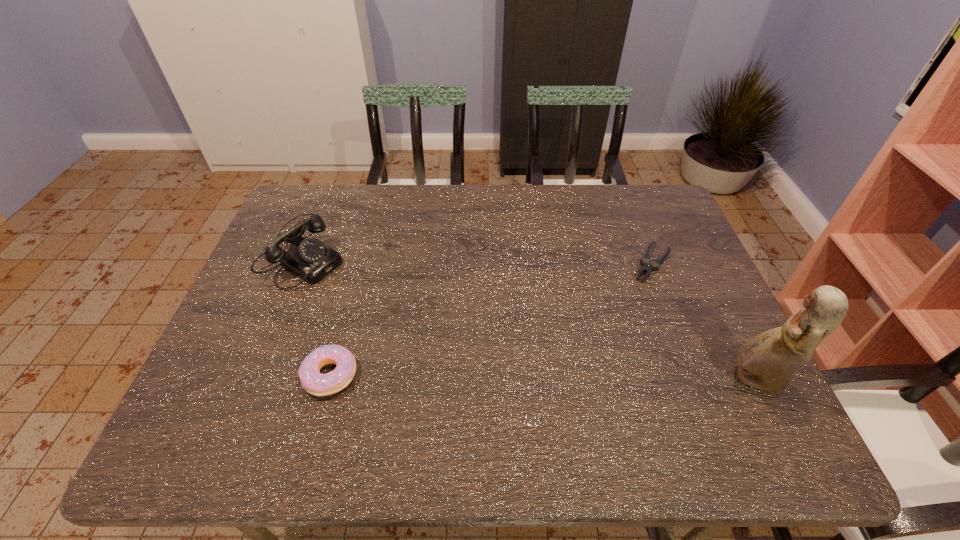
Where is `figurine positioned at the right edge`? The image size is (960, 540). figurine positioned at the right edge is located at coordinates (768, 361).

Identify the location of pliers positioned at the right edge. The image size is (960, 540). (655, 265).

You are a GUI agent. You are given a task and a screenshot of the screen. Output one action in this format:
    pyautogui.click(x=<x>, y=<y>)
    Task: Click on the object that is at the far left corner
    The width and height of the screenshot is (960, 540).
    Given the screenshot: What is the action you would take?
    pyautogui.click(x=308, y=258)

Image resolution: width=960 pixels, height=540 pixels. In order to click on object that is positioned at the near right corner in this screenshot , I will do pyautogui.click(x=768, y=361).

Where is `vacant region at the far edge of the desktop`? vacant region at the far edge of the desktop is located at coordinates (406, 201).

Find the location of a particular element. The height and width of the screenshot is (540, 960). vacant space at the near edge of the desktop is located at coordinates (520, 390).

The width and height of the screenshot is (960, 540). In the image, there is a desktop. Find the location of `free space at the left edge`. free space at the left edge is located at coordinates click(x=238, y=325).

Find the location of a particular element. The height and width of the screenshot is (540, 960). vacant area at the right edge is located at coordinates (693, 313).

In the image, there is a desktop. At what (x,y) coordinates should I click in order to perform the action: click on vacant space at the near left corner. Please return your answer as a coordinate pair (x, y). Looking at the image, I should click on (246, 383).

This screenshot has width=960, height=540. Find the location of `free spot at the far right corner of the desktop`. free spot at the far right corner of the desktop is located at coordinates (645, 186).